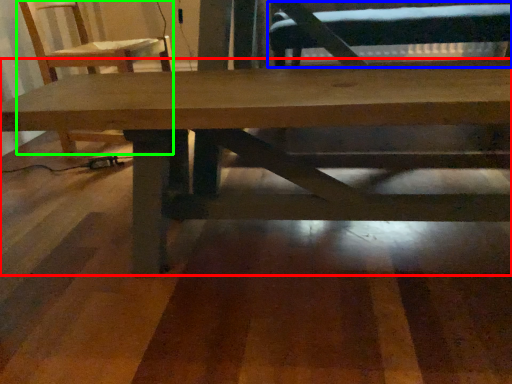
Question: Which object is positioned farthest from table (highlighted by a red box)? Select from swivel chair (highlighted by a blue box) and chair (highlighted by a green box).

Choices:
 (A) swivel chair
 (B) chair

Answer: (A)